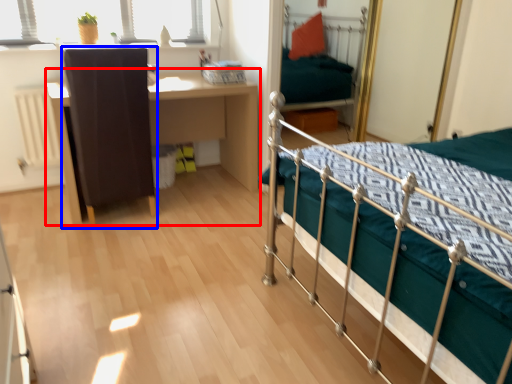
Question: Among these objects, which one is nearest to the camera, desk (highlighted by a red box) or chair (highlighted by a blue box)?

Choices:
 (A) desk
 (B) chair

Answer: (B)